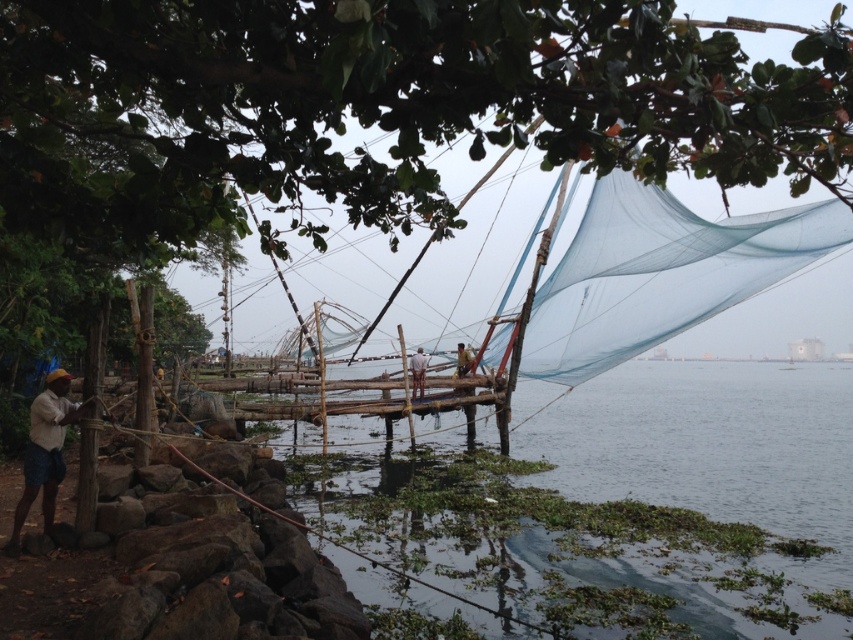
Can you confirm if clear water at center is taller than matte yellow cap at lower left?

Correct, clear water at center is much taller as matte yellow cap at lower left.

How far apart are clear water at center and matte yellow cap at lower left?

13.58 meters

Which is behind, point (529, 604) or point (61, 429)?

The point (529, 604) is behind.

Identify the location of clear water at center. (618, 493).

Which is more to the right, green leafy tree at upper center or clear water at center?

Positioned to the right is clear water at center.

Is green leafy tree at upper center positioned behind clear water at center?

No, green leafy tree at upper center is closer to the viewer.

Image resolution: width=853 pixels, height=640 pixels. What are the coordinates of `green leafy tree at upper center` in the screenshot? It's located at (383, 104).

Find the location of a particular element. This screenshot has width=853, height=640. green leafy tree at upper center is located at coordinates (383, 104).

How much distance is there between clear water at center and white fabric fisherman at center?

A distance of 20.01 feet exists between clear water at center and white fabric fisherman at center.

Is point (532, 435) less distant than point (421, 362)?

No, (532, 435) is further to viewer.

Does point (596, 458) lie behind point (419, 372)?

Yes, it is.

Where is `clear water at center`? The image size is (853, 640). clear water at center is located at coordinates (618, 493).